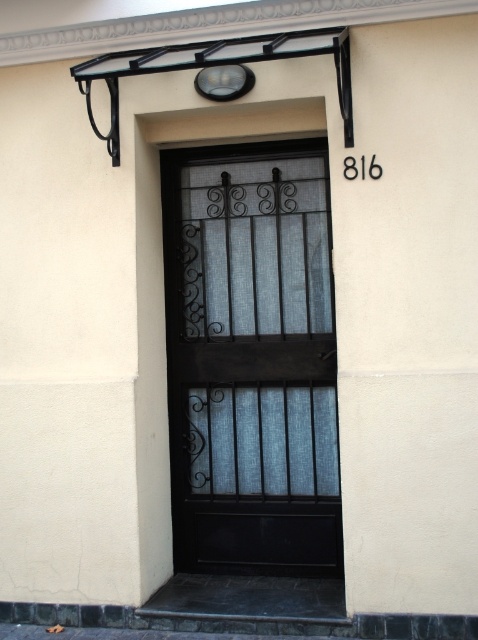
Can you confirm if black wrought iron door at center is taller than matte glass light fixture at upper center?

Yes.

Based on the photo, who is more forward, (224, 316) or (203, 70)?

Positioned in front is point (203, 70).

Which is behind, point (285, 154) or point (217, 99)?

The point (285, 154) is more distant.

Locate an element on the screen. The height and width of the screenshot is (640, 478). black wrought iron door at center is located at coordinates [x=251, y=358].